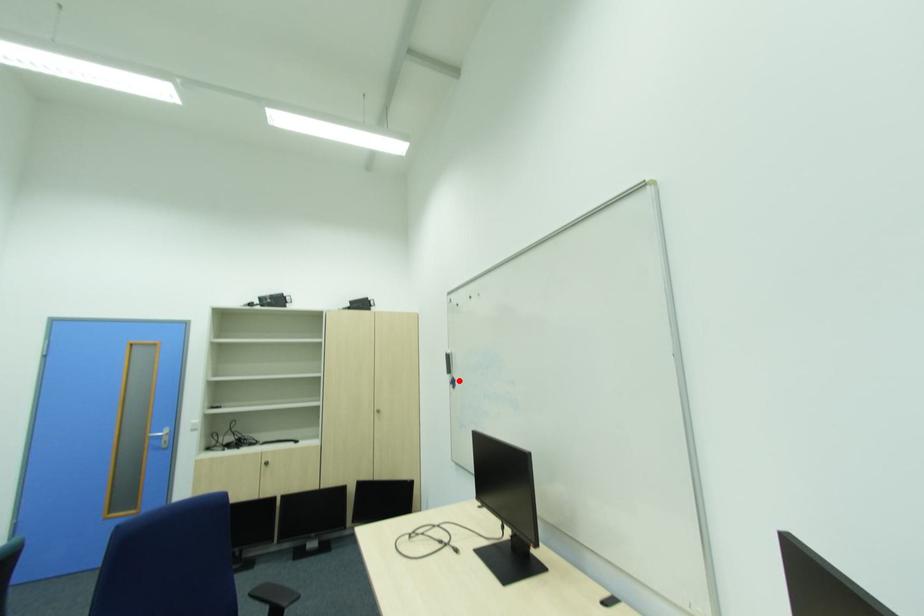
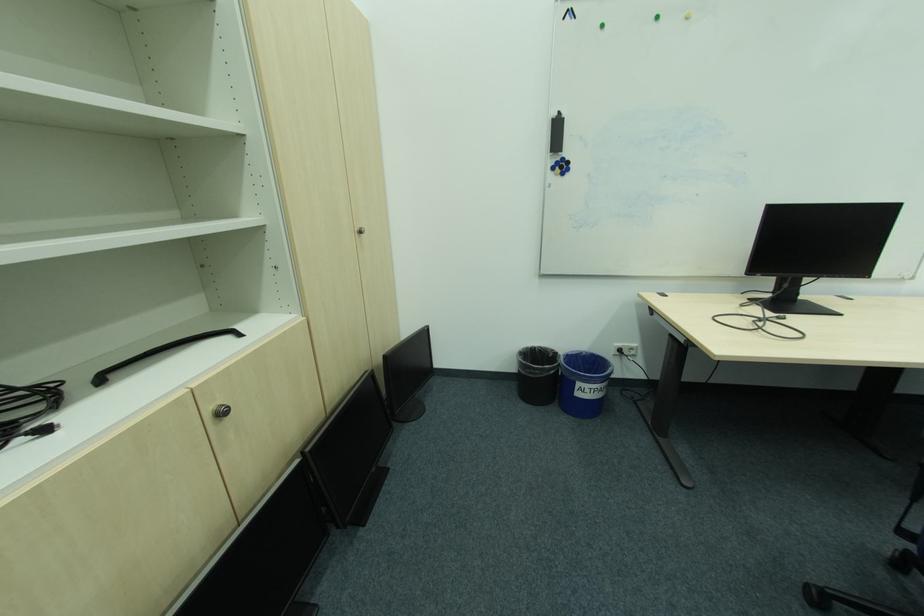
Question: A red point is marked in image1. In image2, is the corresponding 3D point closer to the camera or farther? Reply with the corresponding letter.

Choices:
 (A) The corresponding 3D point is closer.
 (B) The corresponding 3D point is farther.

Answer: (A)